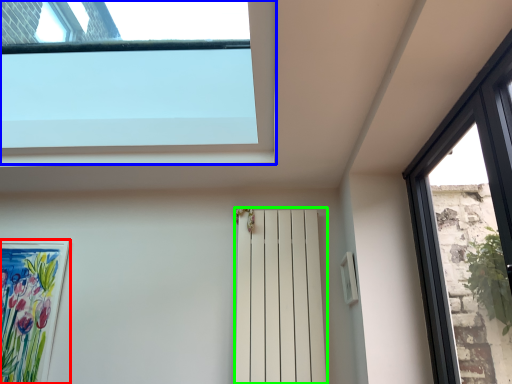
Question: Which is farther away from picture frame (highlighted by a red box)? window (highlighted by a blue box) or shutter (highlighted by a green box)?

Choices:
 (A) window
 (B) shutter

Answer: (B)